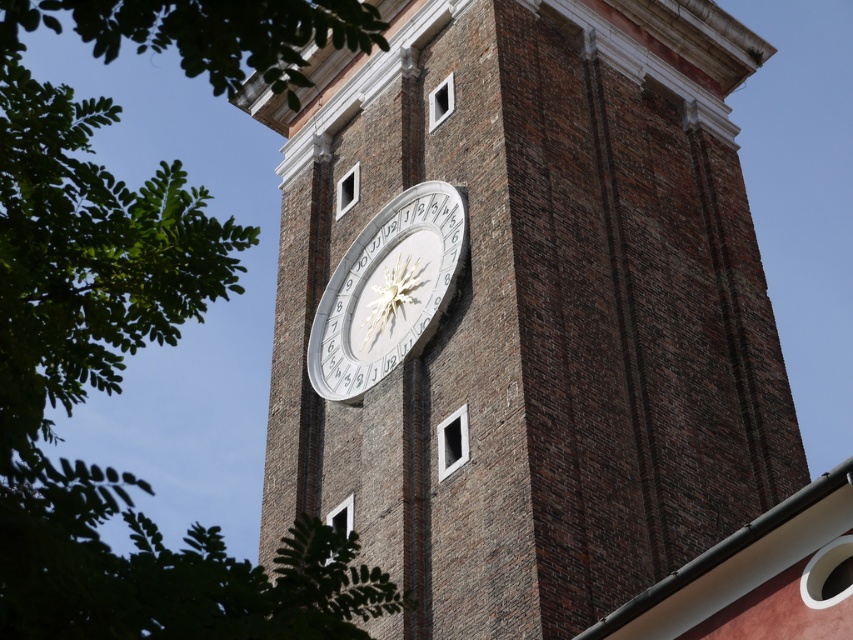
Question: Can you confirm if brown brick clock at center is positioned above green leafy tree at upper left?

Choices:
 (A) yes
 (B) no

Answer: (B)

Question: Does green leafy tree at upper left have a greater width compared to white metallic clock at center?

Choices:
 (A) yes
 (B) no

Answer: (A)

Question: Which of the following is the closest to the observer?

Choices:
 (A) [399, 353]
 (B) [405, 346]
 (C) [135, 307]

Answer: (C)

Question: Is brown brick clock at center above green leafy tree at upper left?

Choices:
 (A) yes
 (B) no

Answer: (B)

Question: Which point is farther to the camera?

Choices:
 (A) white metallic clock at center
 (B) brown brick clock at center
 (C) green leafy tree at upper left

Answer: (A)

Question: Which point is closer to the camera taking this photo?

Choices:
 (A) (170, 305)
 (B) (368, 346)
 (C) (724, 404)

Answer: (A)